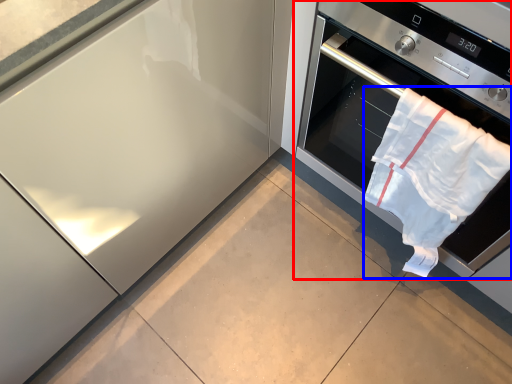
Question: Which object is closer to the camera taking this photo, home appliance (highlighted by a red box) or beach towel (highlighted by a blue box)?

Choices:
 (A) home appliance
 (B) beach towel

Answer: (A)